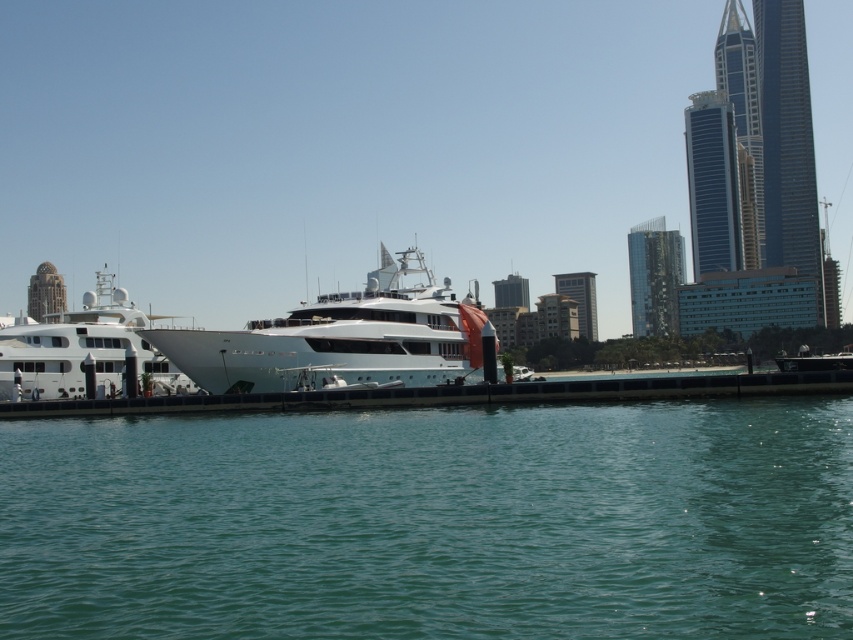
You are a photographer positioned at the waterfront and want to capture both the white glossy yacht at center and the white glossy yacht at left in a single shot. Based on their positions, which yacht will appear closer to the bottom of the photo?

The white glossy yacht at center is located below the white glossy yacht at left, so it will appear closer to the bottom of the photo.

You are standing on the pier and looking at the clear blue water at lower center and the white glossy yacht at left. Which object is closer to you?

The clear blue water at lower center is closer to you because it is in front of the white glossy yacht at left.

You are standing at the camera position observing the waterfront scene. There is a point at coordinates point (206, 371). Can you tell me how far this point is from your current position?

The point at coordinates point (206, 371) is 201.56 feet away from the camera position.